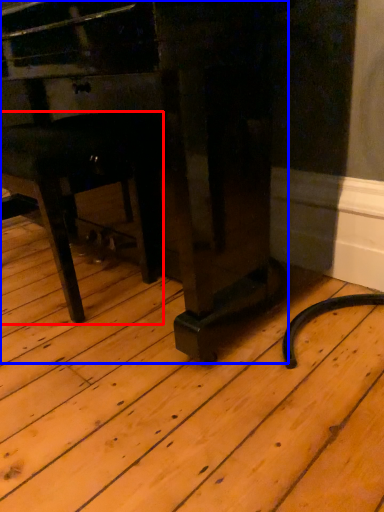
Question: Which of the following is the farthest to the observer, furniture (highlighted by a red box) or furniture (highlighted by a blue box)?

Choices:
 (A) furniture
 (B) furniture

Answer: (A)